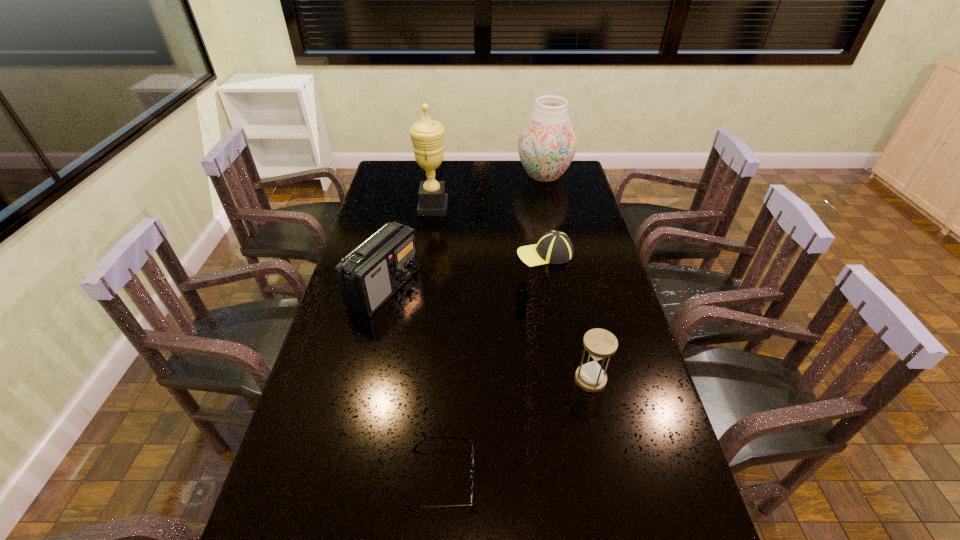
I want to click on object located at the far edge, so click(x=547, y=143).

The width and height of the screenshot is (960, 540). I want to click on object located at the left edge, so click(372, 273).

Where is `vase at the right edge`? vase at the right edge is located at coordinates (547, 143).

The height and width of the screenshot is (540, 960). I want to click on hourglass present at the right edge, so click(x=599, y=343).

Find the location of a particular element. baseball cap present at the right edge is located at coordinates (555, 247).

I want to click on object present at the far right corner, so click(x=547, y=143).

Find the location of a particular element. The width and height of the screenshot is (960, 540). free region at the far edge of the desktop is located at coordinates (460, 176).

The width and height of the screenshot is (960, 540). I want to click on free region at the left edge, so click(x=376, y=331).

Image resolution: width=960 pixels, height=540 pixels. Find the location of `vacant space at the right edge of the desktop`. vacant space at the right edge of the desktop is located at coordinates (574, 301).

In order to click on vacant region at the far left corner of the desktop in this screenshot , I will do `click(395, 166)`.